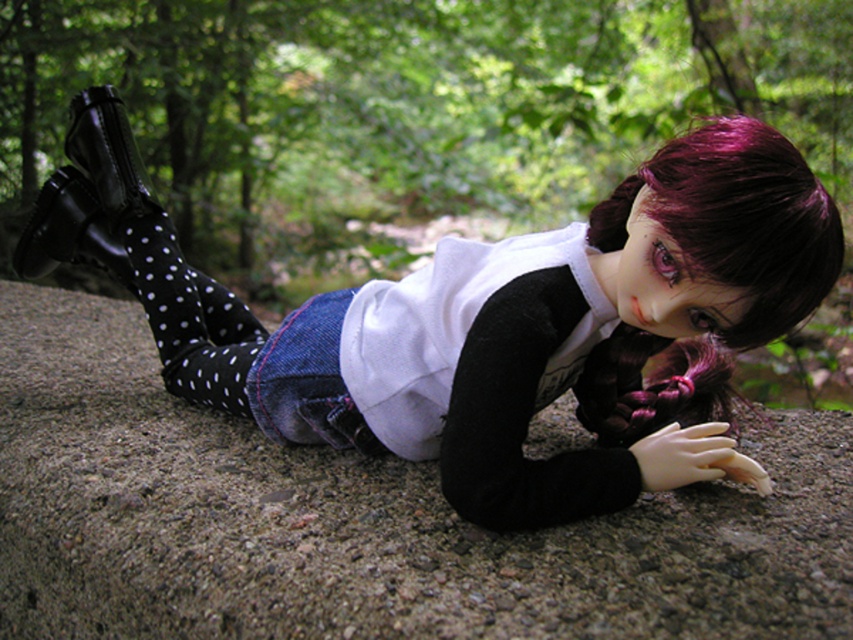
Based on the photo, you are a small robot with a width of 4 inches. You need to move from the gray concrete at center to the white matte shirt at center. Is there enough space for you to pass through the gap between them?

The distance between the gray concrete at center and the white matte shirt at center is 8.30 inches. Since the robot is 4 inches wide, there is sufficient space for it to pass through the gap between them.

You are a small insect crawling on the gray concrete at center. You want to reach the white matte shirt at center. Can you crawl directly to it without moving around any obstacles?

The gray concrete at center is in front of the white matte shirt at center, so there is no obstacle between them. You can crawl directly to the white matte shirt at center.